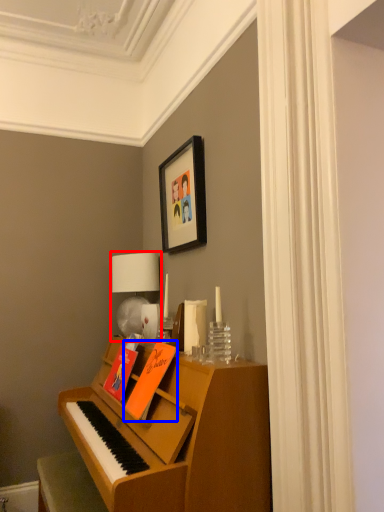
Question: Which object appears closest to the camera in this image, table lamp (highlighted by a red box) or book (highlighted by a blue box)?

Choices:
 (A) table lamp
 (B) book

Answer: (B)